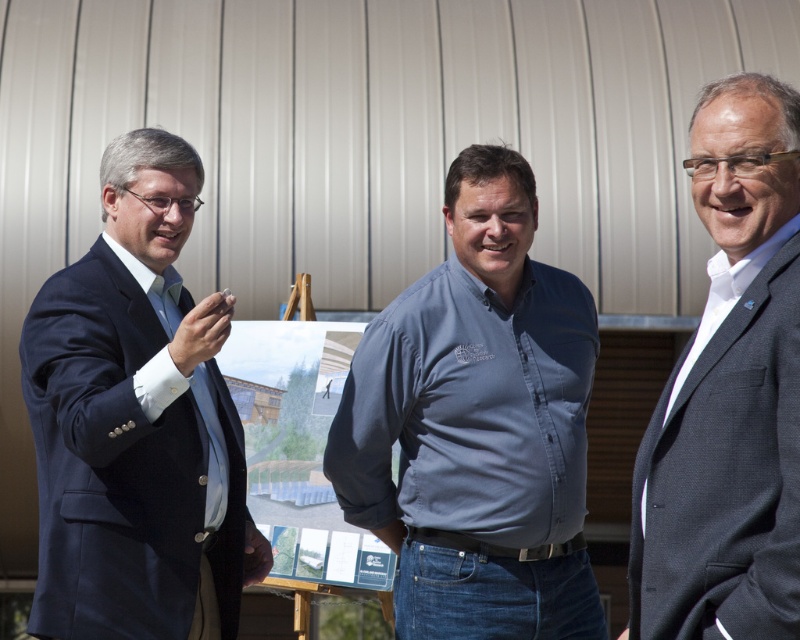
You are standing facing the three people in the scene. You need to hand a document to both the blue cotton shirt at center and the dark blue suit at left. Which person should you approach first if you want to reach the one closer to you?

The blue cotton shirt at center is to the right of dark blue suit at left, so the dark blue suit at left is closer to you. Approach the dark blue suit at left first.